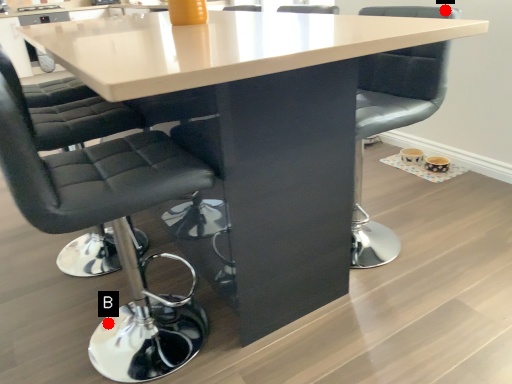
Question: Two points are circled on the image, labeled by A and B beside each circle. Which point is further to the camera?

Choices:
 (A) A is further
 (B) B is further

Answer: (B)